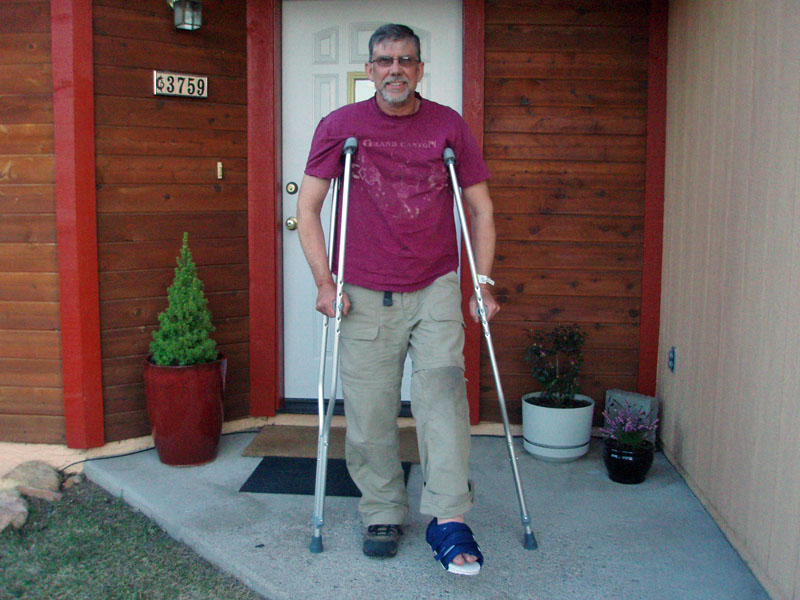
Where is `lock`? The width and height of the screenshot is (800, 600). lock is located at coordinates (289, 185).